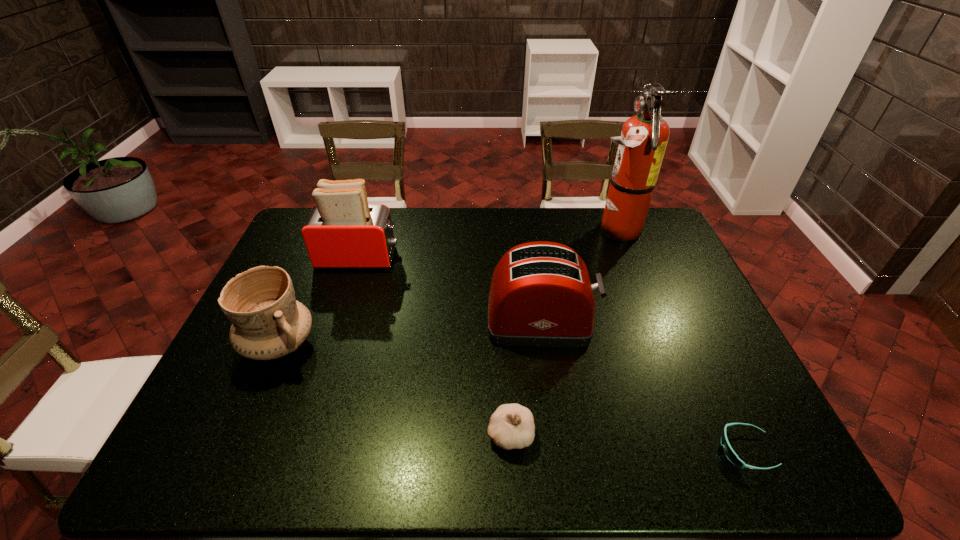
Locate an element on the screen. The width and height of the screenshot is (960, 540). vacant region between the tallest object and the farther toaster is located at coordinates (487, 244).

At what (x,y) coordinates should I click in order to perform the action: click on vacant space in between the fifth shortest object and the pottery. Please return your answer as a coordinate pair (x, y). Image resolution: width=960 pixels, height=540 pixels. Looking at the image, I should click on (319, 301).

At what (x,y) coordinates should I click in order to perform the action: click on free space between the left toaster and the pottery. Please return your answer as a coordinate pair (x, y). Looking at the image, I should click on (319, 301).

The image size is (960, 540). Identify the location of unoccupied position between the garlic and the pottery. (395, 389).

Locate which object is the fifth closest to the sunglasses. Please provide its 2D coordinates. Your answer should be formatted as a tuple, i.e. [(x, y)], where the tuple contains the x and y coordinates of a point satisfying the conditions above.

[(268, 323)]

Identify which object is the fifth nearest to the tallest object. Please provide its 2D coordinates. Your answer should be formatted as a tuple, i.e. [(x, y)], where the tuple contains the x and y coordinates of a point satisfying the conditions above.

[(268, 323)]

Find the location of `blank area in the image that satisfies the following two spatial constraints: 1. on the front-facing side of the right toaster; 2. on the right side of the taller toaster`. blank area in the image that satisfies the following two spatial constraints: 1. on the front-facing side of the right toaster; 2. on the right side of the taller toaster is located at coordinates (339, 320).

Where is `vacant space that satisfies the following two spatial constraints: 1. on the front-facing side of the left toaster; 2. on the right side of the fifth tallest object`? This screenshot has height=540, width=960. vacant space that satisfies the following two spatial constraints: 1. on the front-facing side of the left toaster; 2. on the right side of the fifth tallest object is located at coordinates coord(302,434).